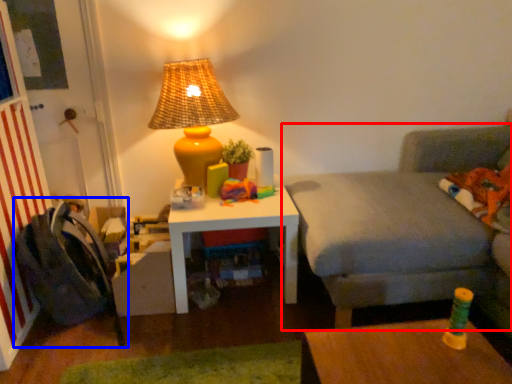
Question: Which object appears closest to the camera in this image, studio couch (highlighted by a red box) or swivel chair (highlighted by a blue box)?

Choices:
 (A) studio couch
 (B) swivel chair

Answer: (A)